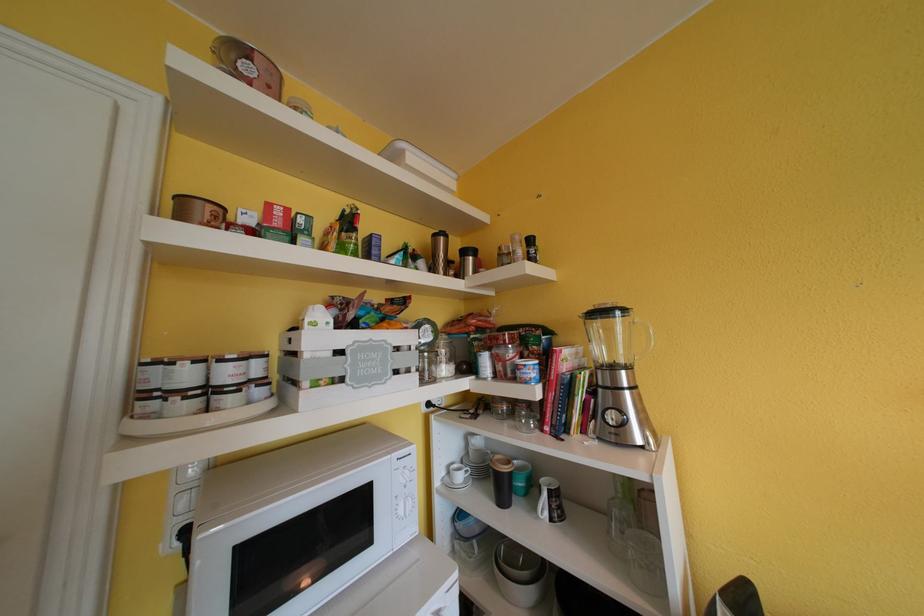
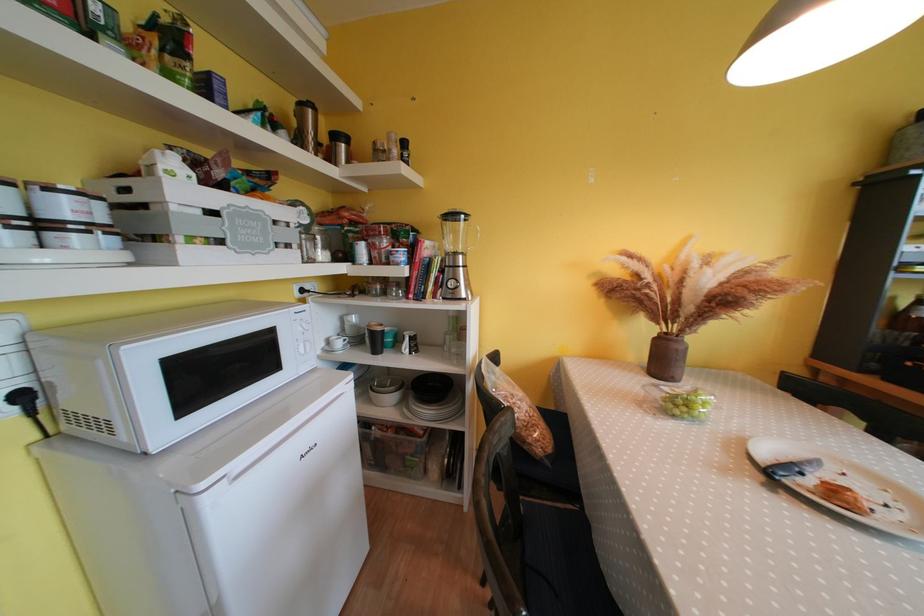
In the second image, find the point that corresponds to [442,238] in the first image.

(308, 108)